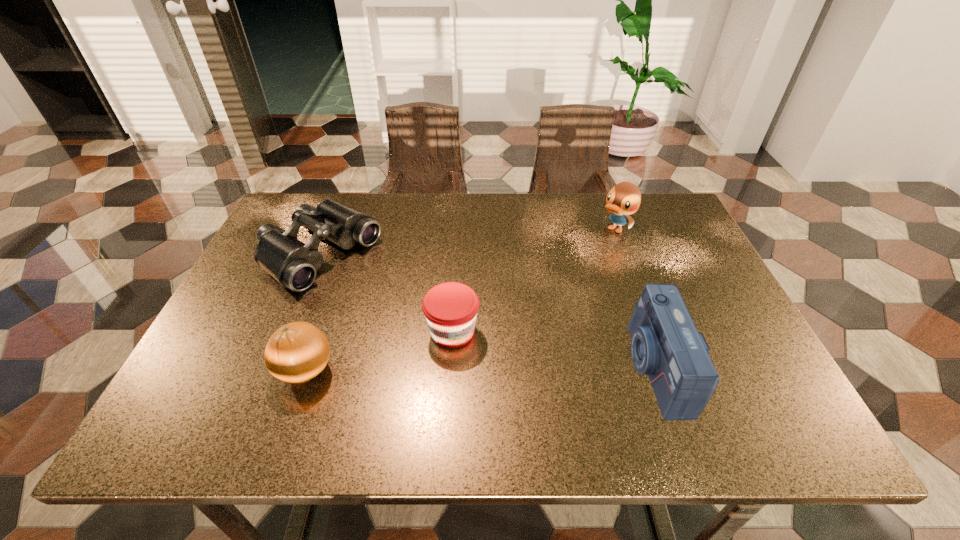
At what (x,y) coordinates should I click in order to perform the action: click on duck that is at the far edge. Please return your answer as a coordinate pair (x, y). Looking at the image, I should click on (624, 198).

You are a GUI agent. You are given a task and a screenshot of the screen. Output one action in this format:
    pyautogui.click(x=<x>, y=<y>)
    Task: Click on the orange present at the near edge
    
    Given the screenshot: What is the action you would take?
    pyautogui.click(x=297, y=352)

Where is `camera positioned at the near edge`? This screenshot has height=540, width=960. camera positioned at the near edge is located at coordinates click(x=665, y=344).

Find the location of a particular element. This screenshot has width=960, height=540. object that is at the left edge is located at coordinates (292, 263).

The width and height of the screenshot is (960, 540). Find the location of `object that is at the right edge`. object that is at the right edge is located at coordinates (624, 198).

Where is `object at the far left corner`? The image size is (960, 540). object at the far left corner is located at coordinates (292, 263).

The width and height of the screenshot is (960, 540). Find the location of `object present at the far right corner`. object present at the far right corner is located at coordinates [x=624, y=198].

Locate an element on the screen. This screenshot has height=540, width=960. vacant space at the far edge of the desktop is located at coordinates (380, 239).

What are the coordinates of `vacant region at the near edge of the desktop` in the screenshot? It's located at (384, 374).

The height and width of the screenshot is (540, 960). Find the location of `vacant space at the left edge of the desktop`. vacant space at the left edge of the desktop is located at coordinates (259, 291).